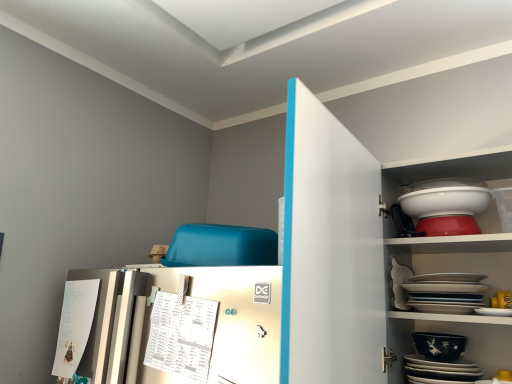
Measure the distance between point (357,167) and camera.

Point (357,167) is 1.14 meters away from camera.

Image resolution: width=512 pixels, height=384 pixels. Find the location of `white glossy platter at upper right, the first platter when ordered from top to bottom`. white glossy platter at upper right, the first platter when ordered from top to bottom is located at coordinates (446, 292).

Describe the element at coordinates (439, 346) in the screenshot. I see `black glossy bowl at lower right, placed as the 1th bowl when sorted from bottom to top` at that location.

Locate an element on the screen. This screenshot has width=512, height=384. black glossy platter at lower right, the second platter positioned from the top is located at coordinates (440, 370).

Which is more to the left, white glossy bowl at upper right, which is the first bowl in top-to-bottom order, or white glossy platter at upper right, acting as the second platter starting from the bottom?

From the viewer's perspective, white glossy platter at upper right, acting as the second platter starting from the bottom, appears more on the left side.

From the image's perspective, does white glossy bowl at upper right, the second bowl ordered from the bottom, appear lower than white glossy platter at upper right, acting as the second platter starting from the bottom?

Incorrect, from the image's perspective, white glossy bowl at upper right, the second bowl ordered from the bottom, is higher than white glossy platter at upper right, acting as the second platter starting from the bottom.

Is white glossy bowl at upper right, which is the first bowl in top-to-bottom order, facing away from white glossy platter at upper right, the first platter when ordered from top to bottom?

No, white glossy bowl at upper right, which is the first bowl in top-to-bottom order,'s orientation is not away from white glossy platter at upper right, the first platter when ordered from top to bottom.

Would you consider white glossy platter at upper right, the first platter when ordered from top to bottom, to be distant from black glossy bowl at lower right, placed as the 1th bowl when sorted from bottom to top?

No, white glossy platter at upper right, the first platter when ordered from top to bottom, is in close proximity to black glossy bowl at lower right, placed as the 1th bowl when sorted from bottom to top.

Is white glossy platter at upper right, the first platter when ordered from top to bottom, positioned beyond the bounds of black glossy bowl at lower right, placed as the 1th bowl when sorted from bottom to top?

white glossy platter at upper right, the first platter when ordered from top to bottom, lies outside black glossy bowl at lower right, placed as the 1th bowl when sorted from bottom to top,'s area.

From the image's perspective, is white glossy platter at upper right, acting as the second platter starting from the bottom, on black glossy bowl at lower right, placed as the 1th bowl when sorted from bottom to top?

Yes, from the image's perspective, white glossy platter at upper right, acting as the second platter starting from the bottom, is over black glossy bowl at lower right, placed as the 1th bowl when sorted from bottom to top.

What's the angular difference between white glossy platter at upper right, acting as the second platter starting from the bottom, and black glossy bowl at lower right, placed as the 1th bowl when sorted from bottom to top,'s facing directions?

0.000273 degrees separate the facing orientations of white glossy platter at upper right, acting as the second platter starting from the bottom, and black glossy bowl at lower right, placed as the 1th bowl when sorted from bottom to top.

Which object is wider, white glossy cabinet at upper right or black glossy platter at lower right, the second platter positioned from the top?

With larger width is white glossy cabinet at upper right.

Which point is more distant from viewer, (x=342, y=267) or (x=420, y=369)?

The point (x=420, y=369) is farther.

At what (x,y) coordinates should I click in order to perform the action: click on the 1st platter behind when counting from the white glossy cabinet at upper right. Please return your answer as a coordinate pair (x, y). The width and height of the screenshot is (512, 384). Looking at the image, I should click on (440, 370).

Can you confirm if white glossy cabinet at upper right is shorter than black glossy platter at lower right, the second platter positioned from the top?

No, white glossy cabinet at upper right is not shorter than black glossy platter at lower right, the second platter positioned from the top.

Considering the sizes of white glossy platter at upper right, acting as the second platter starting from the bottom, and white glossy bowl at upper right, which is the first bowl in top-to-bottom order, in the image, is white glossy platter at upper right, acting as the second platter starting from the bottom, bigger or smaller than white glossy bowl at upper right, which is the first bowl in top-to-bottom order,?

Considering their sizes, white glossy platter at upper right, acting as the second platter starting from the bottom, takes up more space than white glossy bowl at upper right, which is the first bowl in top-to-bottom order.

Which is further, [416,301] or [468,193]?

The point [416,301] is farther from the camera.

From a real-world perspective, between white glossy platter at upper right, acting as the second platter starting from the bottom, and white glossy bowl at upper right, which is the first bowl in top-to-bottom order, who is vertically higher?

In real-world perspective, white glossy bowl at upper right, which is the first bowl in top-to-bottom order, is above.

Is white glossy platter at upper right, acting as the second platter starting from the bottom, taller or shorter than white glossy bowl at upper right, which is the first bowl in top-to-bottom order?

Considering their sizes, white glossy platter at upper right, acting as the second platter starting from the bottom, has more height than white glossy bowl at upper right, which is the first bowl in top-to-bottom order.

Between white glossy bowl at upper right, the second bowl ordered from the bottom, and black glossy platter at lower right, the second platter positioned from the top, which one has smaller width?

With smaller width is white glossy bowl at upper right, the second bowl ordered from the bottom.

From the image's perspective, which platter is the 2nd one below the white glossy bowl at upper right, which is the first bowl in top-to-bottom order? Please provide its 2D coordinates.

[(440, 370)]

Is white glossy bowl at upper right, the second bowl ordered from the bottom, oriented towards black glossy platter at lower right, the second platter positioned from the top?

No, white glossy bowl at upper right, the second bowl ordered from the bottom, is not aimed at black glossy platter at lower right, the second platter positioned from the top.

In the image, is black glossy platter at lower right, which ranks as the 1th platter in bottom-to-top order, positioned in front of or behind black glossy bowl at lower right, placed as the 1th bowl when sorted from bottom to top?

black glossy platter at lower right, which ranks as the 1th platter in bottom-to-top order, is in front of black glossy bowl at lower right, placed as the 1th bowl when sorted from bottom to top.

Is black glossy platter at lower right, which ranks as the 1th platter in bottom-to-top order, not close to black glossy bowl at lower right, the second bowl viewed from the top?

black glossy platter at lower right, which ranks as the 1th platter in bottom-to-top order, is near black glossy bowl at lower right, the second bowl viewed from the top, not far away.

Can you confirm if black glossy platter at lower right, which ranks as the 1th platter in bottom-to-top order, is shorter than black glossy bowl at lower right, placed as the 1th bowl when sorted from bottom to top?

Incorrect, the height of black glossy platter at lower right, which ranks as the 1th platter in bottom-to-top order, does not fall short of that of black glossy bowl at lower right, placed as the 1th bowl when sorted from bottom to top.

Considering the relative sizes of black glossy platter at lower right, which ranks as the 1th platter in bottom-to-top order, and black glossy bowl at lower right, the second bowl viewed from the top, in the image provided, is black glossy platter at lower right, which ranks as the 1th platter in bottom-to-top order, smaller than black glossy bowl at lower right, the second bowl viewed from the top,?

No.

Can you confirm if black glossy platter at lower right, the second platter positioned from the top, is wider than white glossy bowl at upper right, which is the first bowl in top-to-bottom order?

Yes.

Is black glossy platter at lower right, the second platter positioned from the top, far from white glossy bowl at upper right, which is the first bowl in top-to-bottom order?

black glossy platter at lower right, the second platter positioned from the top, is near white glossy bowl at upper right, which is the first bowl in top-to-bottom order, not far away.

How different are the orientations of black glossy platter at lower right, the second platter positioned from the top, and white glossy bowl at upper right, which is the first bowl in top-to-bottom order, in degrees?

black glossy platter at lower right, the second platter positioned from the top, and white glossy bowl at upper right, which is the first bowl in top-to-bottom order, are facing 0.000223 degrees away from each other.

Consider the image. Considering the sizes of objects black glossy platter at lower right, the second platter positioned from the top, and white glossy bowl at upper right, which is the first bowl in top-to-bottom order, in the image provided, who is smaller, black glossy platter at lower right, the second platter positioned from the top, or white glossy bowl at upper right, which is the first bowl in top-to-bottom order,?

With smaller size is white glossy bowl at upper right, which is the first bowl in top-to-bottom order.

The image size is (512, 384). I want to click on the 1st platter to the left of the white glossy bowl at upper right, which is the first bowl in top-to-bottom order, starting your count from the anchor, so click(x=446, y=292).

Identify the location of bowl lying below the white glossy platter at upper right, the first platter when ordered from top to bottom (from the image's perspective). This screenshot has height=384, width=512. (439, 346).

From the image, which object appears to be nearer to black glossy bowl at lower right, the second bowl viewed from the top, white glossy bowl at upper right, the second bowl ordered from the bottom, or white glossy cabinet at upper right?

Based on the image, white glossy cabinet at upper right appears to be nearer to black glossy bowl at lower right, the second bowl viewed from the top.

Looking at the image, which one is located further to white glossy cabinet at upper right, black glossy bowl at lower right, placed as the 1th bowl when sorted from bottom to top, or white glossy bowl at upper right, the second bowl ordered from the bottom?

Based on the image, black glossy bowl at lower right, placed as the 1th bowl when sorted from bottom to top, appears to be further to white glossy cabinet at upper right.

From the image, which object appears to be nearer to white glossy platter at upper right, acting as the second platter starting from the bottom, black glossy bowl at lower right, the second bowl viewed from the top, or white glossy cabinet at upper right?

Based on the image, black glossy bowl at lower right, the second bowl viewed from the top, appears to be nearer to white glossy platter at upper right, acting as the second platter starting from the bottom.

Estimate the real-world distances between objects in this image. Which object is further from white glossy bowl at upper right, which is the first bowl in top-to-bottom order, white glossy cabinet at upper right or black glossy bowl at lower right, the second bowl viewed from the top?

Based on the image, black glossy bowl at lower right, the second bowl viewed from the top, appears to be further to white glossy bowl at upper right, which is the first bowl in top-to-bottom order.

Looking at this image, estimate the real-world distances between objects in this image. Which object is further from white glossy platter at upper right, the first platter when ordered from top to bottom, white glossy bowl at upper right, which is the first bowl in top-to-bottom order, or black glossy platter at lower right, the second platter positioned from the top?

Based on the image, white glossy bowl at upper right, which is the first bowl in top-to-bottom order, appears to be further to white glossy platter at upper right, the first platter when ordered from top to bottom.

Estimate the real-world distances between objects in this image. Which object is further from black glossy bowl at lower right, the second bowl viewed from the top, white glossy cabinet at upper right or white glossy platter at upper right, the first platter when ordered from top to bottom?

white glossy cabinet at upper right is positioned further to the anchor black glossy bowl at lower right, the second bowl viewed from the top.

Considering their positions, is black glossy platter at lower right, which ranks as the 1th platter in bottom-to-top order, positioned further to white glossy cabinet at upper right than white glossy platter at upper right, the first platter when ordered from top to bottom?

black glossy platter at lower right, which ranks as the 1th platter in bottom-to-top order, lies further to white glossy cabinet at upper right than the other object.

Estimate the real-world distances between objects in this image. Which object is further from white glossy platter at upper right, acting as the second platter starting from the bottom, black glossy platter at lower right, which ranks as the 1th platter in bottom-to-top order, or white glossy bowl at upper right, which is the first bowl in top-to-bottom order?

Among the two, white glossy bowl at upper right, which is the first bowl in top-to-bottom order, is located further to white glossy platter at upper right, acting as the second platter starting from the bottom.

At what (x,y) coordinates should I click in order to perform the action: click on bowl between white glossy bowl at upper right, which is the first bowl in top-to-bottom order, and black glossy platter at lower right, the second platter positioned from the top, in the vertical direction. Please return your answer as a coordinate pair (x, y). The image size is (512, 384). Looking at the image, I should click on (439, 346).

Where is `platter located between white glossy cabinet at upper right and white glossy platter at upper right, acting as the second platter starting from the bottom, in the depth direction`? platter located between white glossy cabinet at upper right and white glossy platter at upper right, acting as the second platter starting from the bottom, in the depth direction is located at coordinates (440, 370).

The height and width of the screenshot is (384, 512). What are the coordinates of `platter between white glossy bowl at upper right, the second bowl ordered from the bottom, and black glossy platter at lower right, the second platter positioned from the top, vertically` in the screenshot? It's located at (446, 292).

Identify the location of bowl positioned between white glossy cabinet at upper right and white glossy bowl at upper right, which is the first bowl in top-to-bottom order, from near to far. (439, 346).